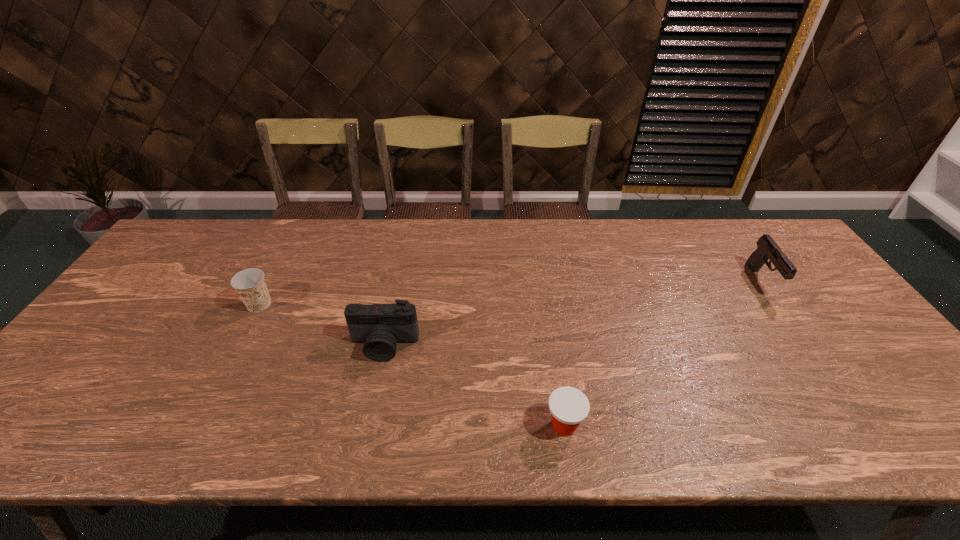
Locate an element on the screen. The image size is (960, 540). free space located on the left of the shorter Dixie cup is located at coordinates pyautogui.click(x=458, y=426).

The width and height of the screenshot is (960, 540). In order to click on object that is at the far edge in this screenshot , I will do `click(767, 248)`.

Find the location of a particular element. The image size is (960, 540). object located at the near edge is located at coordinates (569, 407).

Identify the location of object present at the right edge. This screenshot has width=960, height=540. (767, 248).

Where is `object present at the far right corner`? This screenshot has height=540, width=960. object present at the far right corner is located at coordinates (767, 248).

Find the location of a particular element. Image resolution: width=960 pixels, height=540 pixels. free space at the far edge of the desktop is located at coordinates (288, 226).

At what (x,y) coordinates should I click in order to perform the action: click on vacant region at the left edge of the desktop. Please return your answer as a coordinate pair (x, y). Looking at the image, I should click on click(x=132, y=306).

In the image, there is a desktop. What are the coordinates of `vacant space at the right edge` in the screenshot? It's located at (830, 328).

Identify the location of vacant space at the far right corner of the desktop. (755, 251).

Locate an element on the screen. Image resolution: width=960 pixels, height=540 pixels. vacant region between the camera and the rightmost object is located at coordinates (573, 313).